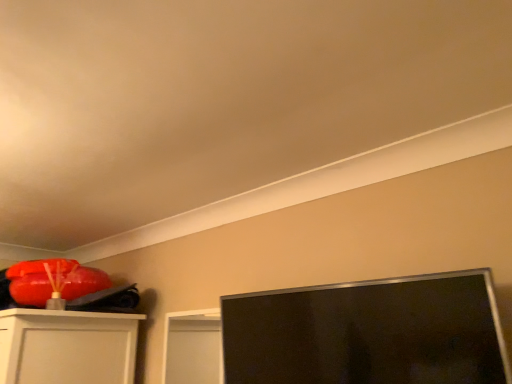
Question: Should I look upward or downward to see matte orange bean bag chair at upper left?

Choices:
 (A) up
 (B) down

Answer: (B)